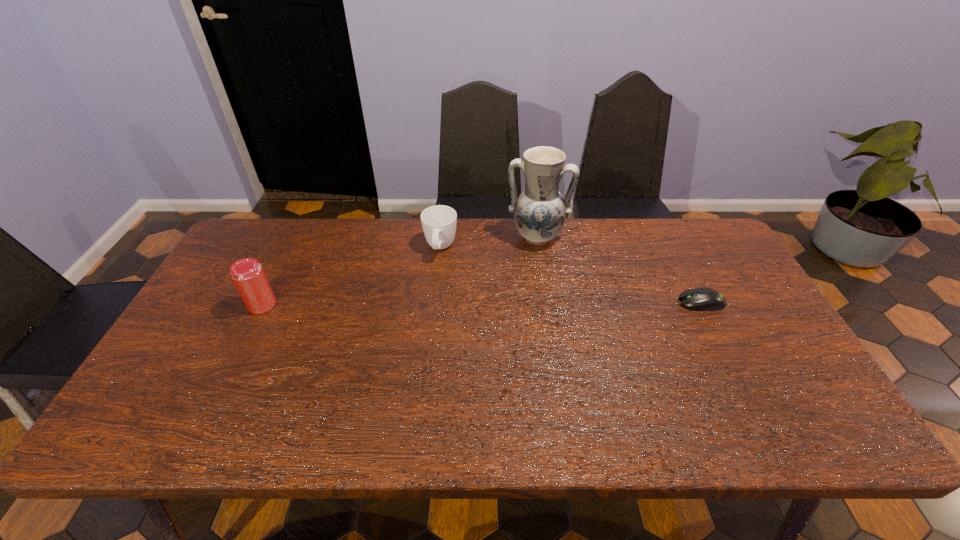
Identify the location of object located in the left edge section of the desktop. This screenshot has width=960, height=540. (247, 274).

Find the location of a particular element. object present at the right edge is located at coordinates (701, 299).

This screenshot has width=960, height=540. In the image, there is a desktop. Identify the location of vacant space at the far edge. (522, 249).

Locate an element on the screen. The image size is (960, 540). vacant region at the near edge of the desktop is located at coordinates (661, 402).

Locate an element on the screen. vacant space at the left edge of the desktop is located at coordinates (169, 366).

Find the location of a particular element. vacant space at the far left corner of the desktop is located at coordinates (262, 241).

Find the location of a particular element. blank space at the far right corner is located at coordinates (710, 238).

In the image, there is a desktop. Where is `vacant space at the near right corner`? The image size is (960, 540). vacant space at the near right corner is located at coordinates (785, 406).

Locate an element on the screen. The width and height of the screenshot is (960, 540). free spot between the tallest object and the computer mouse is located at coordinates (618, 269).

The height and width of the screenshot is (540, 960). In order to click on empty location between the shortest object and the beer can in this screenshot , I will do `click(482, 303)`.